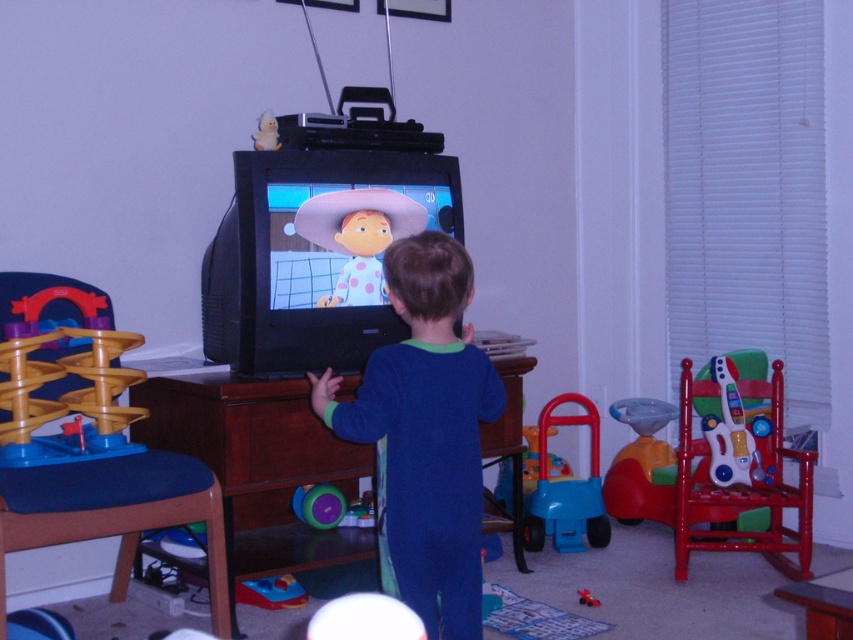
Which is behind, point (9, 465) or point (535, 502)?

The point (535, 502) is behind.

Image resolution: width=853 pixels, height=640 pixels. What do you see at coordinates (61, 378) in the screenshot?
I see `wooden plastic track at left` at bounding box center [61, 378].

Find the location of a particular element. wooden plastic track at left is located at coordinates (61, 378).

Is red plastic guitar at right further to the viewer compared to translucent plastic guitar at right?

No, it is in front of translucent plastic guitar at right.

Does point (751, 356) lie behind point (746, 428)?

Yes.

The width and height of the screenshot is (853, 640). In order to click on red plastic guitar at right in this screenshot , I will do `click(721, 468)`.

Can you confirm if polka dot fabric cowboy hat at upper center is positioned to the right of translucent plastic guitar at right?

Incorrect, polka dot fabric cowboy hat at upper center is not on the right side of translucent plastic guitar at right.

Describe the element at coordinates (358, 236) in the screenshot. I see `polka dot fabric cowboy hat at upper center` at that location.

This screenshot has height=640, width=853. Find the location of `polka dot fabric cowboy hat at upper center`. polka dot fabric cowboy hat at upper center is located at coordinates (358, 236).